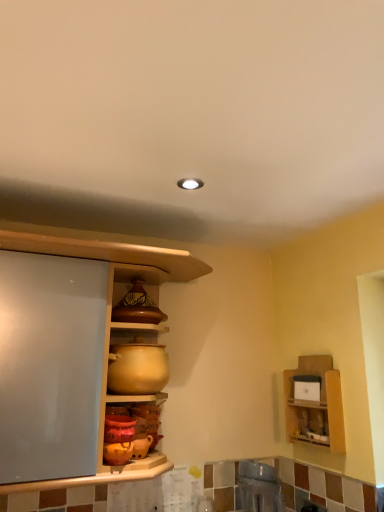
At what (x,y) coordinates should I click in order to perform the action: click on free space above matte brown ceramic pot at upper center (from a real-world perspective). Please return your answer as a coordinate pair (x, y). The image size is (384, 512). Looking at the image, I should click on (141, 278).